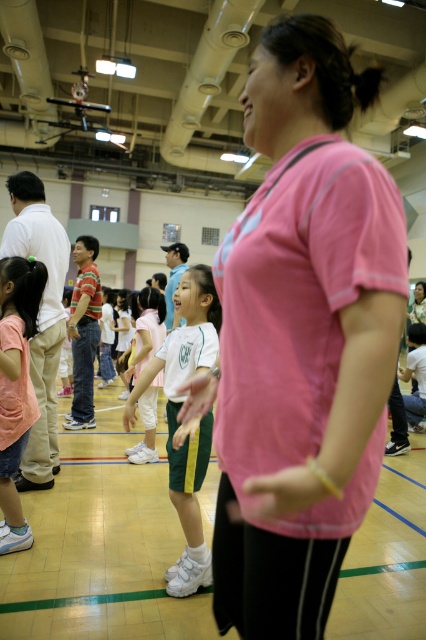
Question: Considering the real-world distances, which object is closest to the matte white shirt at left?

Choices:
 (A) pink matte shirt at lower left
 (B) pink fabric shirt at center
 (C) white matte shorts at center

Answer: (A)

Question: Estimate the real-world distances between objects in this image. Which object is farther from the white matte shorts at center?

Choices:
 (A) matte white shirt at left
 (B) pink fabric shirt at center

Answer: (B)

Question: Is pink matte shirt at lower left wider than white matte shorts at center?

Choices:
 (A) no
 (B) yes

Answer: (A)

Question: Which object is positioned closest to the pink matte shirt at lower left?

Choices:
 (A) matte white shirt at left
 (B) white matte uniform at center

Answer: (A)

Question: In this image, where is white matte uniform at center located relative to matte white shirt at left?

Choices:
 (A) right
 (B) left

Answer: (A)

Question: Is pink fabric shirt at center positioned in front of white matte uniform at center?

Choices:
 (A) yes
 (B) no

Answer: (A)